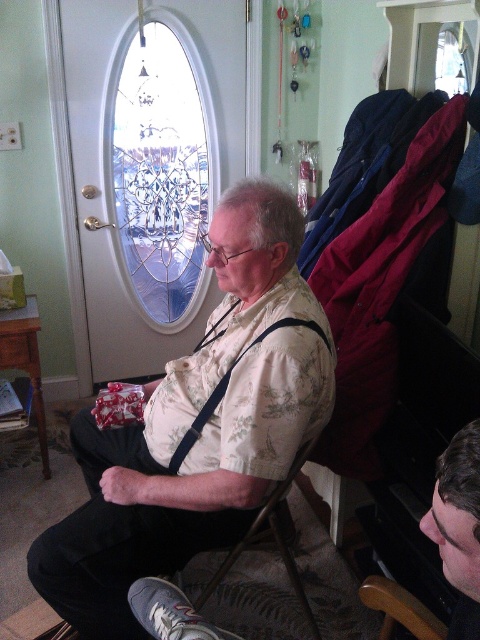
Does floral shirt at center have a lesser height compared to black fabric suspenders at center?

No.

Is the position of floral shirt at center more distant than that of black fabric suspenders at center?

No, floral shirt at center is closer to the viewer.

Which is behind, point (202, 467) or point (276, 323)?

The point (202, 467) is behind.

Locate an element on the screen. The height and width of the screenshot is (640, 480). floral shirt at center is located at coordinates (197, 426).

Who is more distant from viewer, (121, 54) or (429, 509)?

The point (121, 54) is more distant.

Locate an element on the screen. clear glass window at upper center is located at coordinates (160, 168).

Locate an element on the screen. The image size is (480, 640). clear glass window at upper center is located at coordinates (160, 168).

Looking at this image, is floral shirt at center thinner than clear glass window at upper center?

No.

Does floral shirt at center appear on the right side of clear glass window at upper center?

Yes, floral shirt at center is to the right of clear glass window at upper center.

Does point (298, 316) lie behind point (180, 324)?

No, (298, 316) is closer to viewer.

In order to click on floral shirt at center in this screenshot , I will do `click(197, 426)`.